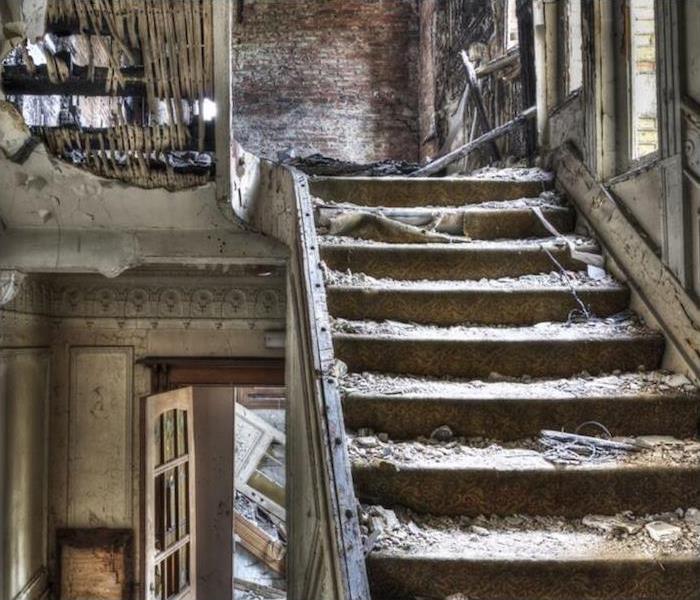
Where is `plaster`? plaster is located at coordinates (29, 195).